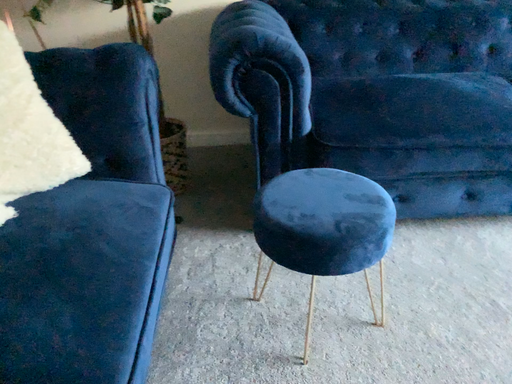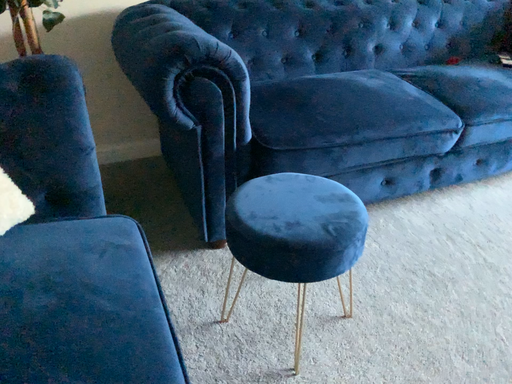
Question: Which way did the camera rotate in the video?

Choices:
 (A) rotated right
 (B) rotated left

Answer: (A)